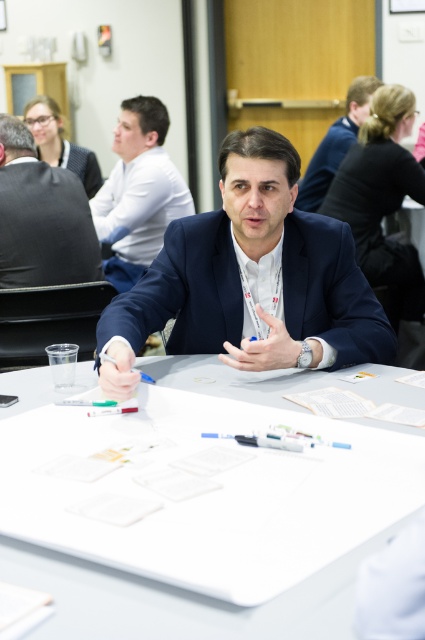
Question: Does white plastic table at center appear over dark gray suit at upper left?

Choices:
 (A) no
 (B) yes

Answer: (A)

Question: Which point is closer to the camera?

Choices:
 (A) white plastic table at center
 (B) matte blue suit at center
 (C) blue suit at center
 (D) dark gray suit at upper left

Answer: (A)

Question: Which object is closer to the camera taking this photo?

Choices:
 (A) white plastic table at center
 (B) matte black suit at upper center

Answer: (A)

Question: Among these objects, which one is nearest to the camera?

Choices:
 (A) blue suit at center
 (B) dark gray suit at upper left
 (C) white plastic table at center

Answer: (C)

Question: Does dark gray suit at upper left appear under matte black suit at upper center?

Choices:
 (A) yes
 (B) no

Answer: (A)

Question: Can you confirm if white plastic table at center is positioned below matte blue suit at center?

Choices:
 (A) yes
 (B) no

Answer: (A)